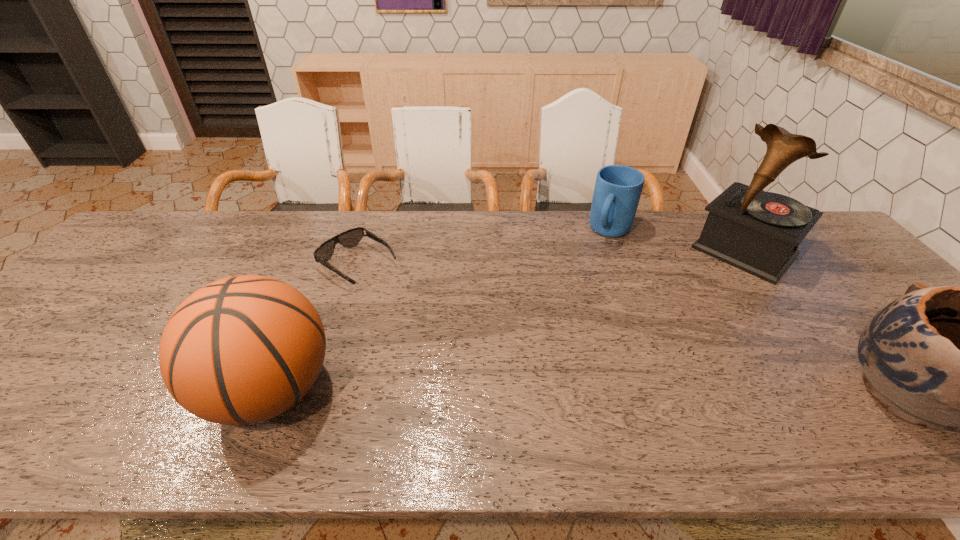
Image resolution: width=960 pixels, height=540 pixels. Find the location of `object at the far right corner`. object at the far right corner is located at coordinates (758, 232).

You are a GUI agent. You are given a task and a screenshot of the screen. Output one action in this format:
    pyautogui.click(x=<x>, y=<y>)
    Task: Click on the free region at the far edge of the desktop
    The width and height of the screenshot is (960, 540).
    Given the screenshot: What is the action you would take?
    pyautogui.click(x=584, y=231)

I want to click on vacant space at the near edge, so click(x=461, y=381).

At what (x,y) coordinates should I click in order to perform the action: click on vacant area at the left edge. Please return your answer as a coordinate pair (x, y). The height and width of the screenshot is (540, 960). Looking at the image, I should click on (97, 276).

Locate an element on the screen. Image resolution: width=960 pixels, height=540 pixels. free space at the right edge of the desktop is located at coordinates (804, 266).

Where is `vacant space that's between the tallest object and the basketball`? The height and width of the screenshot is (540, 960). vacant space that's between the tallest object and the basketball is located at coordinates (507, 320).

Locate an element on the screen. The height and width of the screenshot is (540, 960). vacant area between the second tallest object and the second shortest object is located at coordinates (441, 310).

At what (x,y) coordinates should I click in order to perform the action: click on vacant point located between the tallest object and the fourth shortest object. Please return your answer as a coordinate pair (x, y). Image resolution: width=960 pixels, height=540 pixels. Looking at the image, I should click on (507, 320).

Where is `empty location between the phonograph_record and the basketball`? This screenshot has height=540, width=960. empty location between the phonograph_record and the basketball is located at coordinates (507, 320).

Where is `vacant region between the shortest object and the third object from right to left`? Image resolution: width=960 pixels, height=540 pixels. vacant region between the shortest object and the third object from right to left is located at coordinates (485, 248).